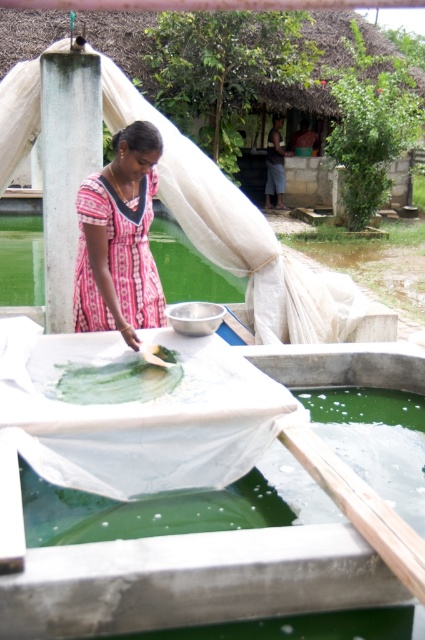
You are an artisan working in this outdoor setting. You need to choose between the green translucent pool at lower center and the green matte paint at center for a project that requires a larger quantity of material. Which one should you choose and why?

You should choose the green translucent pool at lower center because it has a larger size compared to the green matte paint at center, providing more material for the project.

You are an artist visiting a rural village and see the pink printed dress at center and the green matte paint at center in the scene. Which object is closer to you as you face the image?

The pink printed dress at center is closer to you because the green matte paint at center is behind it.